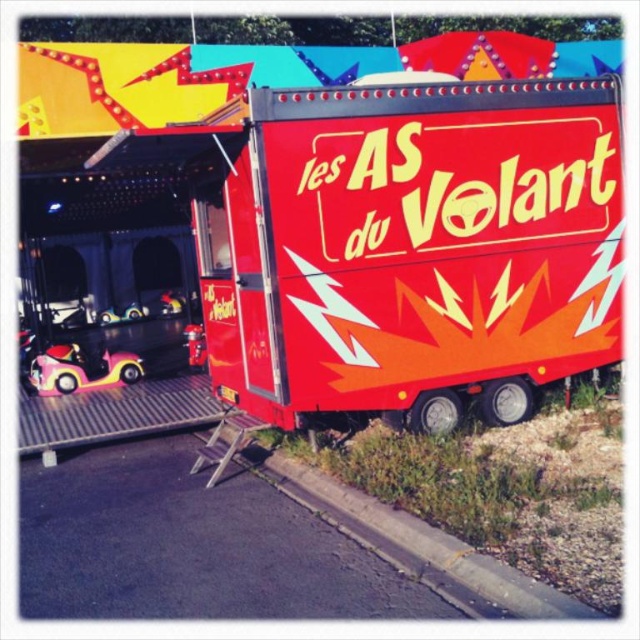
Question: Which point appears farthest from the camera in this image?

Choices:
 (A) (561, 188)
 (B) (100, 372)

Answer: (B)

Question: In this image, where is pink rubber toy car at left located relative to pink rubber bumper car at lower left?

Choices:
 (A) right
 (B) left

Answer: (B)

Question: Considering the relative positions of shiny red trailer at center and pink rubber bumper car at lower left in the image provided, where is shiny red trailer at center located with respect to pink rubber bumper car at lower left?

Choices:
 (A) right
 (B) left

Answer: (A)

Question: Based on their relative distances, which object is nearer to the shiny red trailer at center?

Choices:
 (A) pink rubber bumper car at lower left
 (B) pink rubber toy car at left
 (C) shiny red trailer truck at center

Answer: (C)

Question: Is shiny red trailer truck at center closer to the viewer compared to shiny red trailer at center?

Choices:
 (A) yes
 (B) no

Answer: (B)

Question: Among these points, which one is nearest to the camera?

Choices:
 (A) (531, 410)
 (B) (38, 362)
 (C) (294, 486)

Answer: (C)